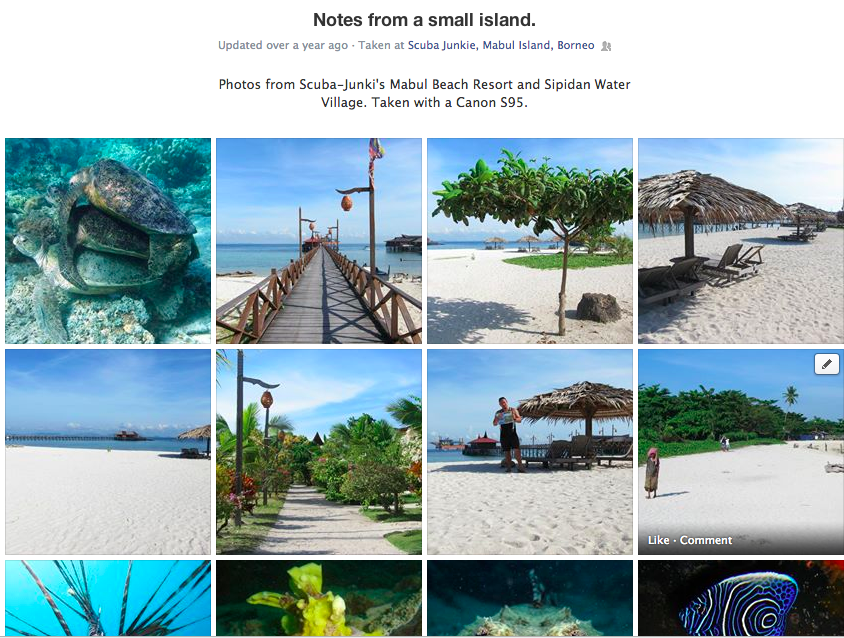
Where is `chair`? chair is located at coordinates (690, 268), (655, 279), (713, 262), (748, 249), (555, 450), (620, 448), (591, 447).